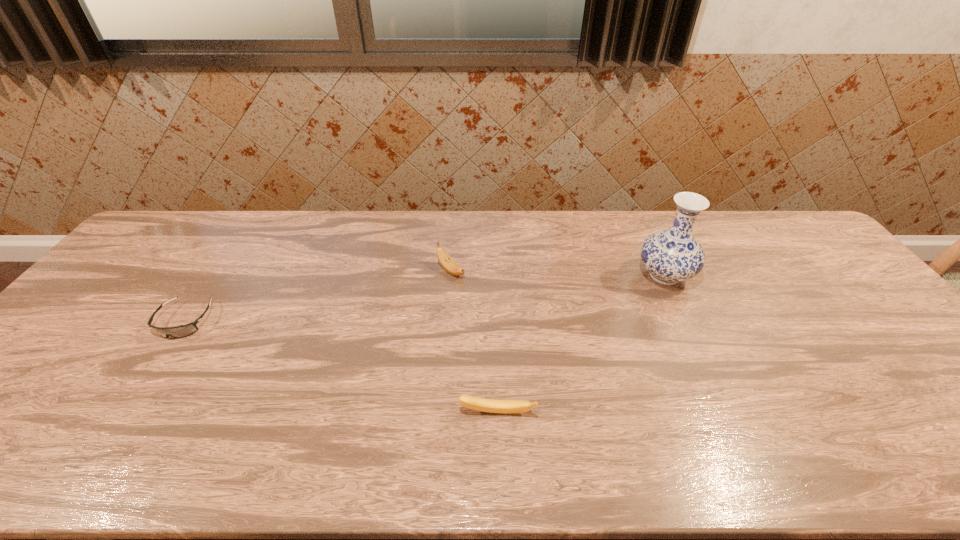
The image size is (960, 540). Find the location of `free region at the far edge of the desktop`. free region at the far edge of the desktop is located at coordinates (208, 237).

The width and height of the screenshot is (960, 540). I want to click on free space at the near edge of the desktop, so click(x=36, y=467).

The width and height of the screenshot is (960, 540). Find the location of `free space at the left edge of the desktop`. free space at the left edge of the desktop is located at coordinates (109, 306).

At what (x,y) coordinates should I click in order to perform the action: click on vacant space at the right edge of the desktop. Please return your answer as a coordinate pair (x, y). Looking at the image, I should click on (918, 359).

Find the location of a particular element. Image resolution: width=960 pixels, height=540 pixels. vacant point at the far right corner is located at coordinates (777, 237).

Where is `free space between the nearer banana and the leftmost object`? free space between the nearer banana and the leftmost object is located at coordinates (341, 367).

The height and width of the screenshot is (540, 960). Identify the location of free space between the shortest object and the farther banana. (318, 296).

Where is `blank region between the nearest object and the vase`? The width and height of the screenshot is (960, 540). blank region between the nearest object and the vase is located at coordinates (581, 344).

The image size is (960, 540). I want to click on empty space that is in between the farther banana and the second nearest object, so click(318, 296).

At what (x,y) coordinates should I click in order to perform the action: click on empty space that is in between the nearer banana and the tallest object. Please return your answer as a coordinate pair (x, y). Image resolution: width=960 pixels, height=540 pixels. Looking at the image, I should click on (581, 344).